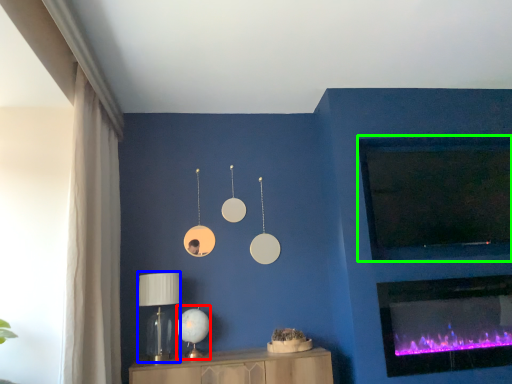
Question: Based on their relative distances, which object is farther from table lamp (highlighted by a red box)? Choose from table lamp (highlighted by a blue box) and window screen (highlighted by a green box).

Choices:
 (A) table lamp
 (B) window screen

Answer: (B)